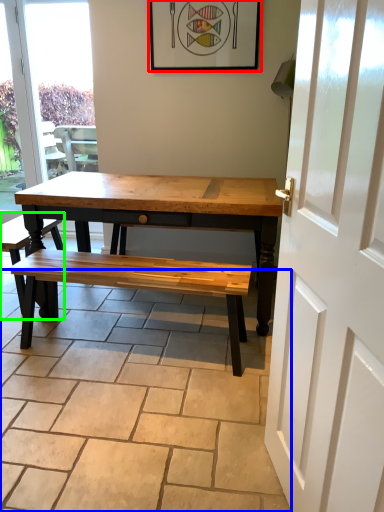
Question: Which object is positioned farthest from picture frame (highlighted by a red box)? Select from path (highlighted by a blue box) and church bench (highlighted by a green box).

Choices:
 (A) path
 (B) church bench

Answer: (A)